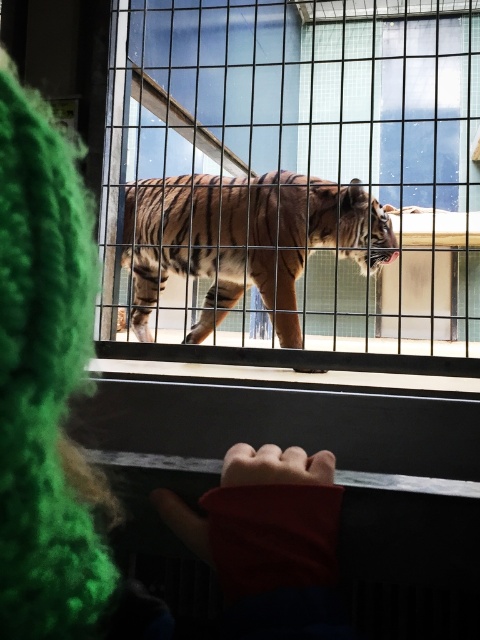
Can you confirm if clear glass window at center is positioned to the left of green fuzzy sweater at upper left?

→ Incorrect, clear glass window at center is not on the left side of green fuzzy sweater at upper left.

Is clear glass window at center above green fuzzy sweater at upper left?

Yes.

This screenshot has width=480, height=640. What do you see at coordinates (295, 180) in the screenshot?
I see `clear glass window at center` at bounding box center [295, 180].

Where is `clear glass window at center`? This screenshot has width=480, height=640. clear glass window at center is located at coordinates (x=295, y=180).

In the scene shown: Is green fuzzy sweater at upper left below striped fur tiger at center?

Correct, green fuzzy sweater at upper left is located below striped fur tiger at center.

Does green fuzzy sweater at upper left come in front of striped fur tiger at center?

Yes, it is in front of striped fur tiger at center.

Between point (248, 589) and point (312, 198), which one is positioned in front?

Point (248, 589) is in front.

Identify the location of green fuzzy sweater at upper left. The image size is (480, 640). (43, 356).

Does clear glass window at center have a larger size compared to striped fur tiger at center?

Yes.

Is clear glass window at center shorter than striped fur tiger at center?

Incorrect, clear glass window at center's height does not fall short of striped fur tiger at center's.

Image resolution: width=480 pixels, height=640 pixels. Describe the element at coordinates (295, 180) in the screenshot. I see `clear glass window at center` at that location.

Find the location of a particular element. clear glass window at center is located at coordinates (295, 180).